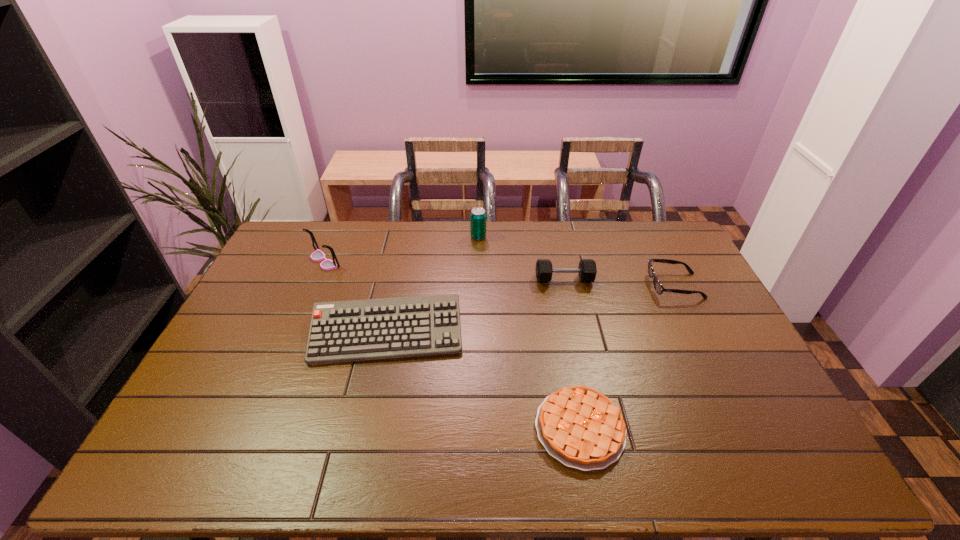
Locate an element on the screen. The width and height of the screenshot is (960, 540). object that is at the left edge is located at coordinates (318, 255).

Where is `object at the right edge`? The width and height of the screenshot is (960, 540). object at the right edge is located at coordinates (659, 288).

What are the coordinates of `object that is positioned at the far left corner` in the screenshot? It's located at (318, 255).

What are the coordinates of `vacant space at the far edge of the desktop` in the screenshot? It's located at (519, 233).

You are a GUI agent. You are given a task and a screenshot of the screen. Output one action in this format:
    pyautogui.click(x=<x>, y=<y>)
    Task: Click on the vacant space at the left edge
    
    Given the screenshot: What is the action you would take?
    pyautogui.click(x=173, y=436)

Identify the location of vacant area at the right edge of the desktop. (750, 423).

The width and height of the screenshot is (960, 540). Identify the location of free location at the near right corner of the desktop. (756, 453).

The height and width of the screenshot is (540, 960). What are the coordinates of `free space between the computer keyboard and the farthest object` in the screenshot? It's located at (433, 286).

You are a GUI agent. You are given a task and a screenshot of the screen. Output one action in this format:
    pyautogui.click(x=<x>, y=<y>)
    Task: Click on the free spot between the taller spectacles and the farthest object
    
    Given the screenshot: What is the action you would take?
    pyautogui.click(x=401, y=249)

Locate an element on the screen. The width and height of the screenshot is (960, 540). empty space between the third object from left to right and the pie is located at coordinates (529, 333).